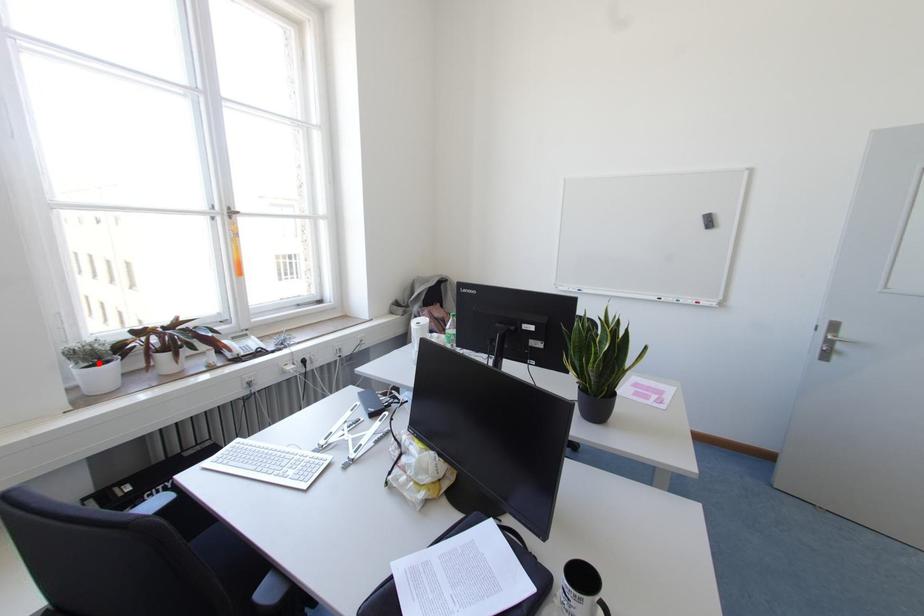
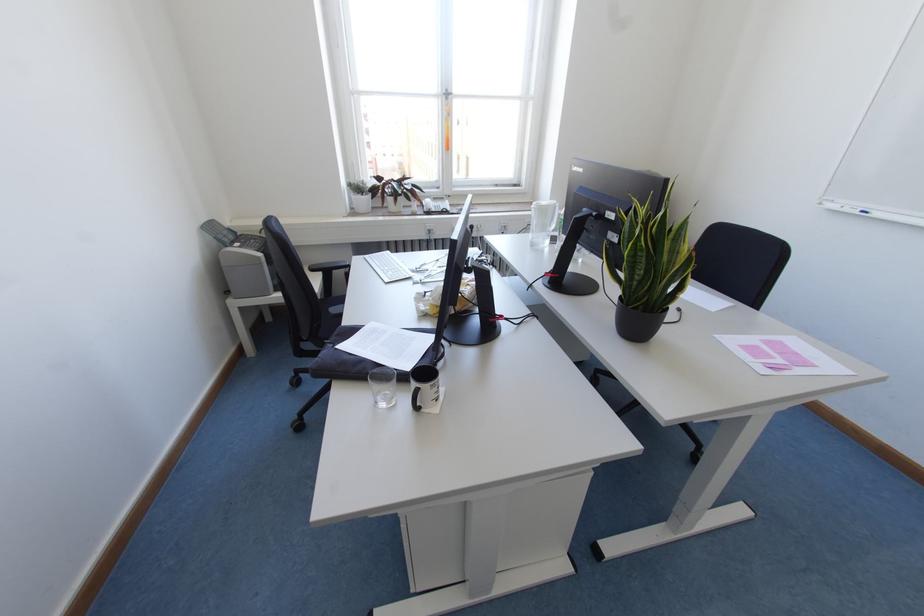
Question: I am providing you with two images of the same scene from different viewpoints. A red point is shown in image1. For the corresponding object point in image2, is it positioned nearer or farther from the camera?

Choices:
 (A) Nearer
 (B) Farther

Answer: (A)